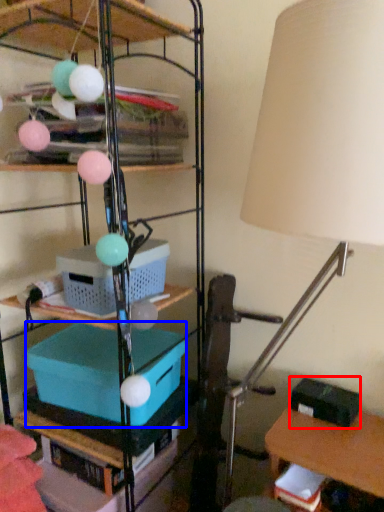
Question: Which of the following is the closest to the observer, storage box (highlighted by a red box) or storage box (highlighted by a blue box)?

Choices:
 (A) storage box
 (B) storage box

Answer: (B)